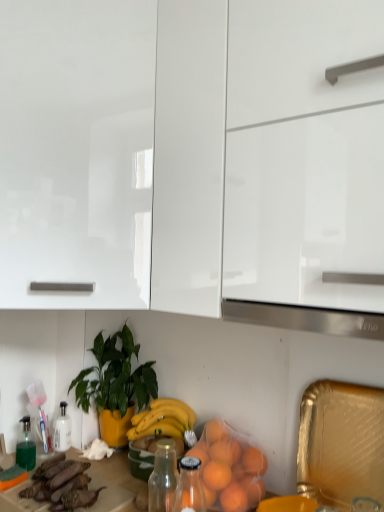
Question: Considering the relative sizes of glossy white cabinet at upper left, the 2th cabinetry in the right-to-left sequence, and green glossy plant at center in the image provided, is glossy white cabinet at upper left, the 2th cabinetry in the right-to-left sequence, wider than green glossy plant at center?

Choices:
 (A) yes
 (B) no

Answer: (A)

Question: Can green glossy plant at center be found inside glossy white cabinet at upper left, which is the 1th cabinetry from left to right?

Choices:
 (A) yes
 (B) no

Answer: (B)

Question: Does glossy white cabinet at upper left, which is the 1th cabinetry from left to right, appear on the right side of green glossy plant at center?

Choices:
 (A) yes
 (B) no

Answer: (B)

Question: Is glossy white cabinet at upper left, the 2th cabinetry in the right-to-left sequence, shorter than green glossy plant at center?

Choices:
 (A) yes
 (B) no

Answer: (B)

Question: Is glossy white cabinet at upper left, which is the 1th cabinetry from left to right, facing away from green glossy plant at center?

Choices:
 (A) no
 (B) yes

Answer: (A)

Question: Is green glossy plant at center taller or shorter than purple matte eggplant at lower left?

Choices:
 (A) tall
 (B) short

Answer: (A)

Question: From the image's perspective, relative to purple matte eggplant at lower left, is green glossy plant at center above or below?

Choices:
 (A) below
 (B) above

Answer: (B)

Question: Considering the positions of green glossy plant at center and purple matte eggplant at lower left in the image, is green glossy plant at center bigger or smaller than purple matte eggplant at lower left?

Choices:
 (A) small
 (B) big

Answer: (B)

Question: Would you say green glossy plant at center is to the left or to the right of purple matte eggplant at lower left in the picture?

Choices:
 (A) right
 (B) left

Answer: (A)

Question: Is satin silver exhaust hood at center taller or shorter than glossy white cabinet at upper left, the 2th cabinetry in the right-to-left sequence?

Choices:
 (A) short
 (B) tall

Answer: (A)

Question: In terms of width, does satin silver exhaust hood at center look wider or thinner when compared to glossy white cabinet at upper left, the 2th cabinetry in the right-to-left sequence?

Choices:
 (A) wide
 (B) thin

Answer: (B)

Question: From a real-world perspective, is satin silver exhaust hood at center positioned above or below glossy white cabinet at upper left, which is the 1th cabinetry from left to right?

Choices:
 (A) above
 (B) below

Answer: (B)

Question: Is satin silver exhaust hood at center situated inside glossy white cabinet at upper left, the 2th cabinetry in the right-to-left sequence, or outside?

Choices:
 (A) outside
 (B) inside

Answer: (A)

Question: In terms of size, does orange matte plastic bag at lower center appear bigger or smaller than glossy white cabinet at upper left, the 2th cabinetry in the right-to-left sequence?

Choices:
 (A) big
 (B) small

Answer: (B)

Question: Considering the positions of orange matte plastic bag at lower center and glossy white cabinet at upper left, the 2th cabinetry in the right-to-left sequence, in the image, is orange matte plastic bag at lower center taller or shorter than glossy white cabinet at upper left, the 2th cabinetry in the right-to-left sequence,?

Choices:
 (A) tall
 (B) short

Answer: (B)